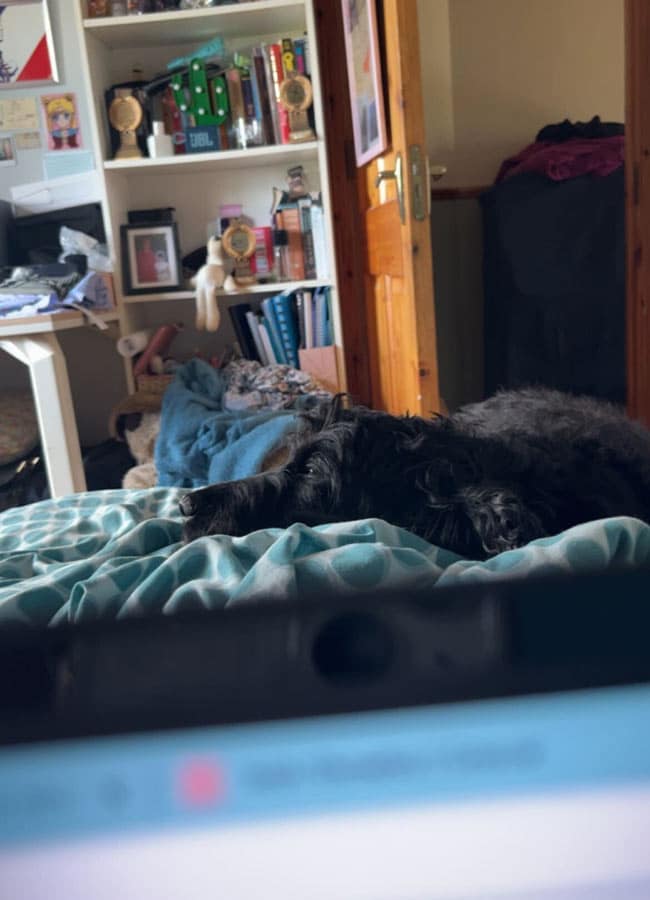
Identify the location of beige wall. This screenshot has height=900, width=650. (502, 78).